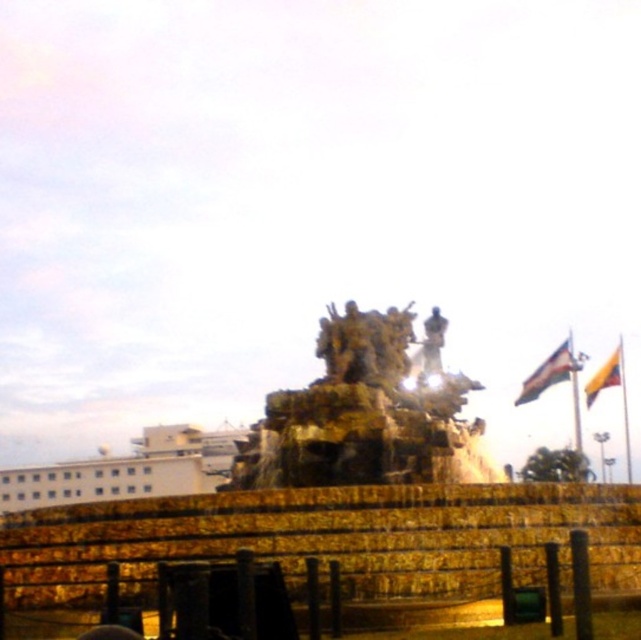
Question: Can you confirm if gold metallic fountain at center is positioned to the left of gold textured statue at center?

Choices:
 (A) yes
 (B) no

Answer: (A)

Question: Which point is closer to the camera taking this photo?

Choices:
 (A) (558, 362)
 (B) (429, 321)
 (C) (353, 333)

Answer: (C)

Question: Which point is closer to the camera taking this photo?

Choices:
 (A) (197, 481)
 (B) (601, 384)

Answer: (A)

Question: Is gold textured statue at center further to camera compared to polished bronze statue at center?

Choices:
 (A) no
 (B) yes

Answer: (A)

Question: Which object is positioned closest to the blue fabric flag at right?

Choices:
 (A) golden stone fountain at center
 (B) polished bronze statue at center
 (C) gold textured statue at center

Answer: (B)

Question: Does golden stone fountain at center have a lesser width compared to gold textured statue at center?

Choices:
 (A) no
 (B) yes

Answer: (A)